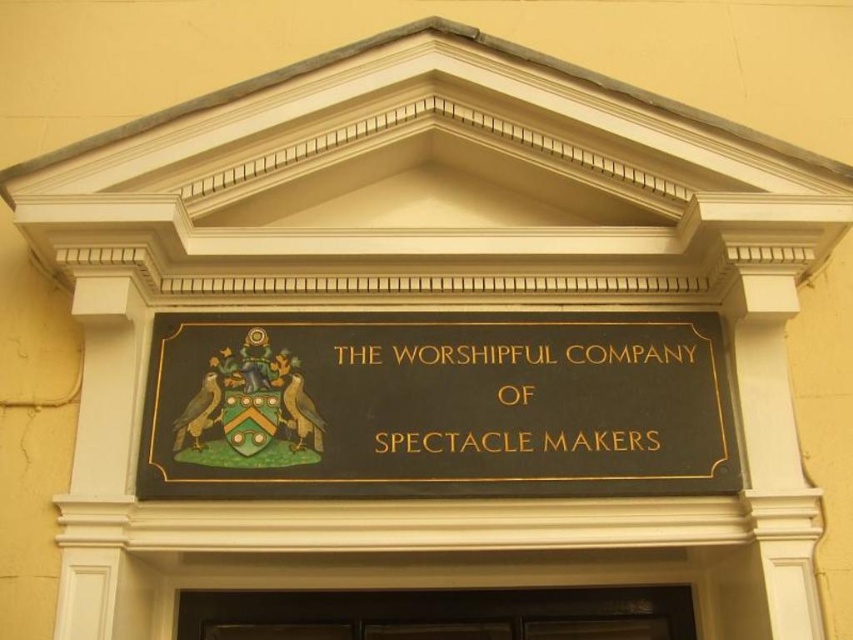
Is black polished wood sign at center further to camera compared to black wood door at center?

No, it is in front of black wood door at center.

Who is more distant from viewer, (364, 376) or (398, 611)?

Positioned behind is point (398, 611).

Measure the distance between black polished wood sign at center and camera.

black polished wood sign at center is 24.77 feet from camera.

Find the location of a particular element. This screenshot has height=640, width=853. black polished wood sign at center is located at coordinates coord(436,404).

In the scene shown: Which of these two, black polished wood sign at center or goldmaterial/texturetext at center, stands shorter?

goldmaterial/texturetext at center is shorter.

Does black polished wood sign at center have a greater height compared to goldmaterial/texturetext at center?

Yes.

Find the location of a particular element. This screenshot has width=853, height=640. black polished wood sign at center is located at coordinates (436, 404).

Is goldmaterial/texturetext at center below black wood door at center?

No.

Between point (561, 352) and point (433, 593), which one is positioned behind?

Positioned behind is point (433, 593).

Locate an element on the screen. goldmaterial/texturetext at center is located at coordinates 520,394.